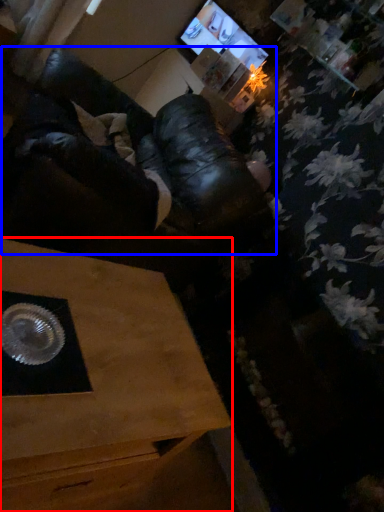
Question: Which point is further to the camera, table (highlighted by a red box) or squat (highlighted by a blue box)?

Choices:
 (A) table
 (B) squat

Answer: (B)